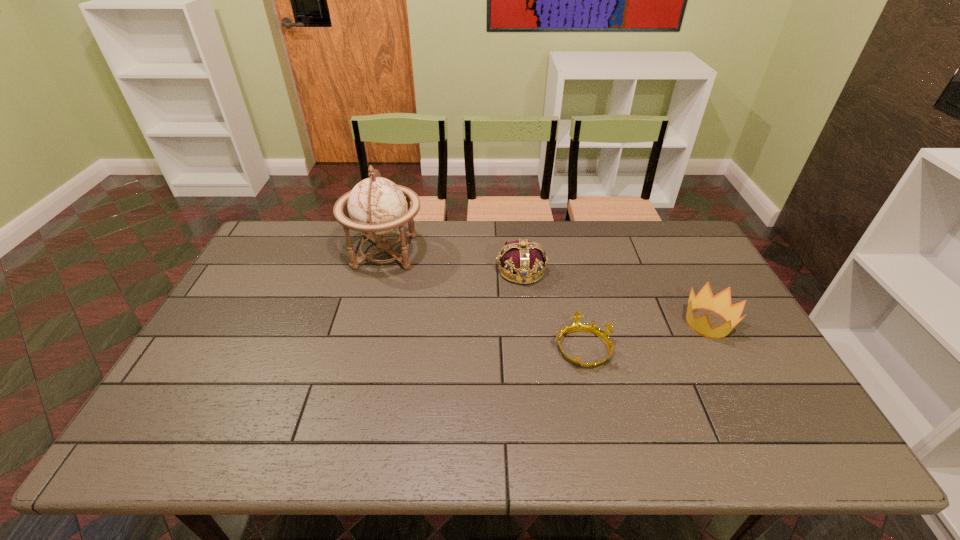
Select which crown is the second closest to the shortest crown. Please provide its 2D coordinates. Your answer should be formatted as a tuple, i.e. [(x, y)], where the tuple contains the x and y coordinates of a point satisfying the conditions above.

[(721, 303)]

At what (x,y) coordinates should I click in order to perform the action: click on crown identified as the second closest to the tallest crown. Please return your answer as a coordinate pair (x, y). Looking at the image, I should click on (721, 303).

Image resolution: width=960 pixels, height=540 pixels. In order to click on vacant region that satisfies the following two spatial constraints: 1. at the front of the leftmost object showing Africa; 2. on the back side of the shortest object in this screenshot , I will do `click(360, 348)`.

Image resolution: width=960 pixels, height=540 pixels. What are the coordinates of `vacant region that satisfies the following two spatial constraints: 1. on the front side of the second shortest crown; 2. on the right side of the tallest crown` in the screenshot? It's located at (527, 323).

Where is `free space that satisfies the following two spatial constraints: 1. at the front of the globe showing Africa; 2. on the left side of the tallest crown`? free space that satisfies the following two spatial constraints: 1. at the front of the globe showing Africa; 2. on the left side of the tallest crown is located at coordinates (380, 271).

I want to click on free space in the image that satisfies the following two spatial constraints: 1. on the front side of the second shortest object; 2. on the right side of the third shortest object, so click(x=527, y=323).

Identify the location of vacant space that satisfies the following two spatial constraints: 1. at the front of the leftmost object showing Africa; 2. on the right side of the rightmost crown. (367, 323).

Find the location of a particular element. The height and width of the screenshot is (540, 960). free space in the image that satisfies the following two spatial constraints: 1. at the front of the shortest crown showing Africa; 2. on the right side of the globe is located at coordinates (360, 348).

Locate an element on the screen. This screenshot has height=540, width=960. free space that satisfies the following two spatial constraints: 1. at the front of the shortest crown showing Africa; 2. on the left side of the globe is located at coordinates (360, 348).

The width and height of the screenshot is (960, 540). What are the coordinates of `vacant area in the image that satisfies the following two spatial constraints: 1. at the front of the second tallest object showing Africa; 2. on the right side of the leftmost object` in the screenshot? It's located at pyautogui.click(x=380, y=271).